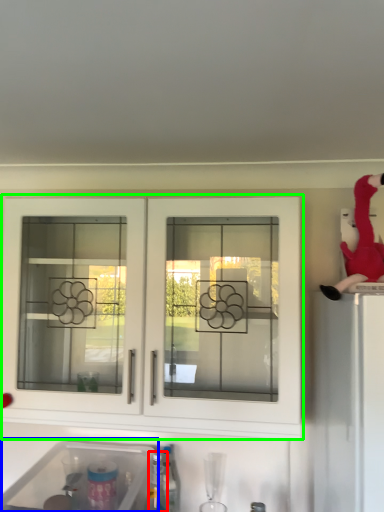
Question: Which is nearer to the bottle (highlighted by a red box)? sink (highlighted by a blue box) or cabinetry (highlighted by a green box).

Choices:
 (A) sink
 (B) cabinetry

Answer: (A)